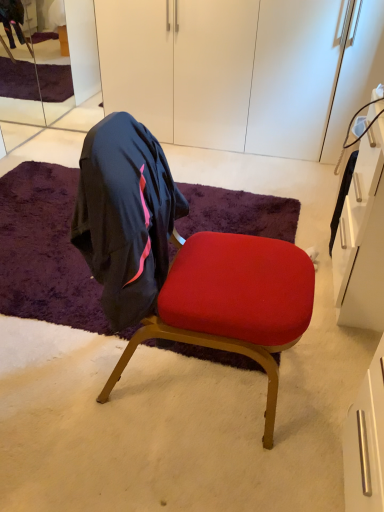
Question: Is white matte cabinet at upper center bigger than clear glass mirror at upper left?

Choices:
 (A) no
 (B) yes

Answer: (B)

Question: Is white matte cabinet at upper center far away from clear glass mirror at upper left?

Choices:
 (A) yes
 (B) no

Answer: (A)

Question: Is white matte cabinet at upper center further to camera compared to clear glass mirror at upper left?

Choices:
 (A) yes
 (B) no

Answer: (B)

Question: Considering the relative sizes of white matte cabinet at upper center and clear glass mirror at upper left in the image provided, is white matte cabinet at upper center shorter than clear glass mirror at upper left?

Choices:
 (A) yes
 (B) no

Answer: (B)

Question: Is white matte cabinet at upper center outside of clear glass mirror at upper left?

Choices:
 (A) yes
 (B) no

Answer: (A)

Question: Considering the relative positions of white matte cabinet at upper center and clear glass mirror at upper left in the image provided, is white matte cabinet at upper center to the left of clear glass mirror at upper left from the viewer's perspective?

Choices:
 (A) yes
 (B) no

Answer: (B)

Question: Is white matte cabinet at upper center thinner than velvet red chair at center?

Choices:
 (A) yes
 (B) no

Answer: (B)

Question: From a real-world perspective, is white matte cabinet at upper center on velvet red chair at center?

Choices:
 (A) yes
 (B) no

Answer: (A)

Question: Does white matte cabinet at upper center come in front of velvet red chair at center?

Choices:
 (A) no
 (B) yes

Answer: (A)

Question: Is white matte cabinet at upper center at the left side of velvet red chair at center?

Choices:
 (A) yes
 (B) no

Answer: (B)

Question: Is white matte cabinet at upper center facing away from velvet red chair at center?

Choices:
 (A) yes
 (B) no

Answer: (B)

Question: From the image's perspective, would you say white matte cabinet at upper center is shown under velvet red chair at center?

Choices:
 (A) yes
 (B) no

Answer: (B)

Question: Is clear glass mirror at upper left completely or partially outside of velvet red chair at center?

Choices:
 (A) no
 (B) yes

Answer: (B)